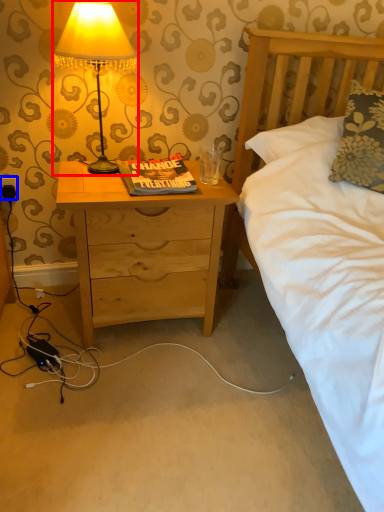
Question: Which object is closer to the camera taking this photo, lamp (highlighted by a red box) or electric outlet (highlighted by a blue box)?

Choices:
 (A) lamp
 (B) electric outlet

Answer: (A)